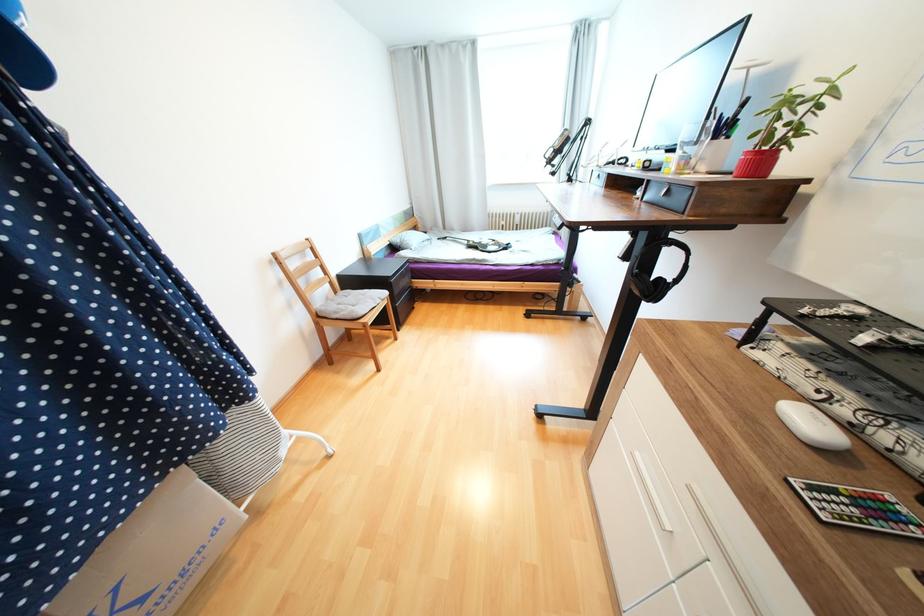
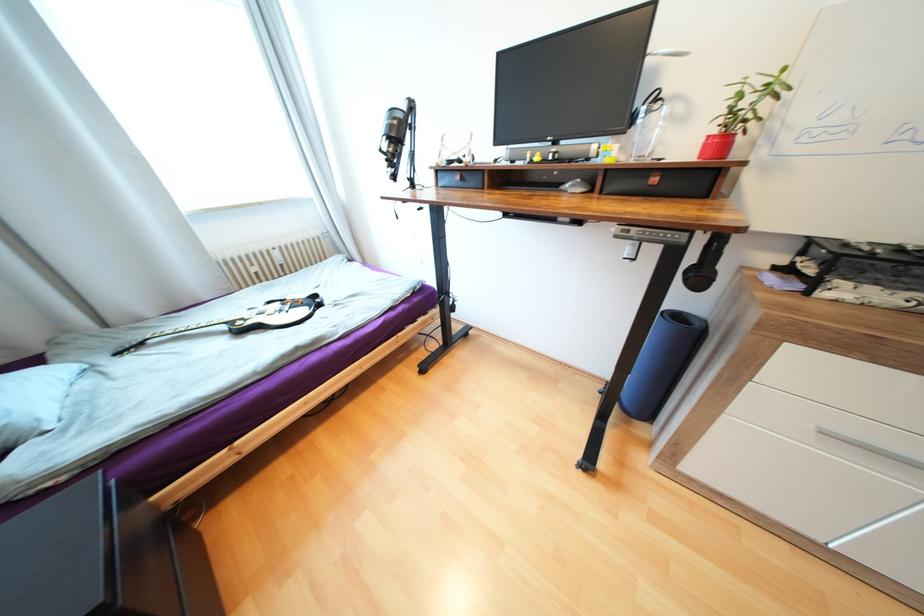
Locate, in the second image, the point that corresponds to the point at 471,243 in the first image.

(229, 328)